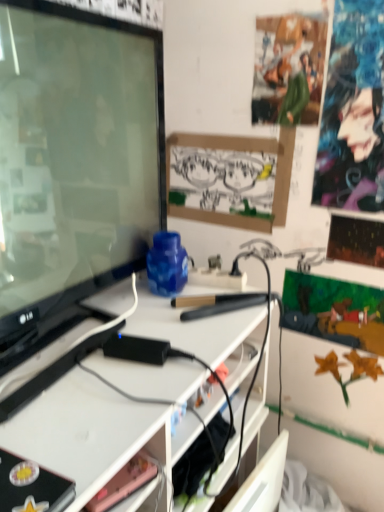
Question: Can you confirm if pink matte phone at lower center is positioned to the left of green fabric poster at upper center?

Choices:
 (A) yes
 (B) no

Answer: (A)

Question: Does pink matte phone at lower center touch green fabric poster at upper center?

Choices:
 (A) no
 (B) yes

Answer: (A)

Question: From a real-world perspective, is pink matte phone at lower center beneath green fabric poster at upper center?

Choices:
 (A) yes
 (B) no

Answer: (A)

Question: Can you confirm if pink matte phone at lower center is positioned to the right of green fabric poster at upper center?

Choices:
 (A) no
 (B) yes

Answer: (A)

Question: Can green fabric poster at upper center be found inside pink matte phone at lower center?

Choices:
 (A) yes
 (B) no

Answer: (B)

Question: From a real-world perspective, is matte black book at lower left above or below black paperboard at center?

Choices:
 (A) below
 (B) above

Answer: (A)

Question: Is point (18, 488) closer or farther from the camera than point (182, 163)?

Choices:
 (A) closer
 (B) farther

Answer: (A)

Question: Is matte black book at lower left taller or shorter than black paperboard at center?

Choices:
 (A) short
 (B) tall

Answer: (A)

Question: From the image's perspective, is matte black book at lower left positioned above or below black paperboard at center?

Choices:
 (A) below
 (B) above

Answer: (A)

Question: Do you think matte black book at lower left is within matte black tv at left, or outside of it?

Choices:
 (A) inside
 (B) outside

Answer: (B)

Question: Does point tap(43, 476) appear closer or farther from the camera than point tap(51, 150)?

Choices:
 (A) closer
 (B) farther

Answer: (A)

Question: Looking at their shapes, would you say matte black book at lower left is wider or thinner than matte black tv at left?

Choices:
 (A) wide
 (B) thin

Answer: (A)

Question: From the image's perspective, is matte black book at lower left positioned above or below matte black tv at left?

Choices:
 (A) above
 (B) below

Answer: (B)

Question: From a real-world perspective, is matte black tv at left positioned above or below matte black book at lower left?

Choices:
 (A) below
 (B) above

Answer: (B)

Question: Considering the positions of point (36, 325) and point (64, 495), is point (36, 325) closer or farther from the camera than point (64, 495)?

Choices:
 (A) farther
 (B) closer

Answer: (A)